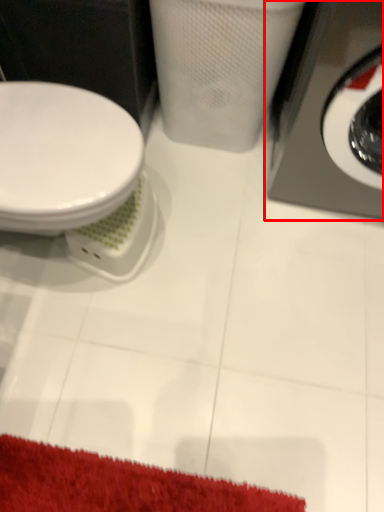
Question: From the image's perspective, considering the relative positions of washing machine (annotated by the red box) and toilet in the image provided, where is washing machine (annotated by the red box) located with respect to the staircase?

Choices:
 (A) above
 (B) below

Answer: (A)